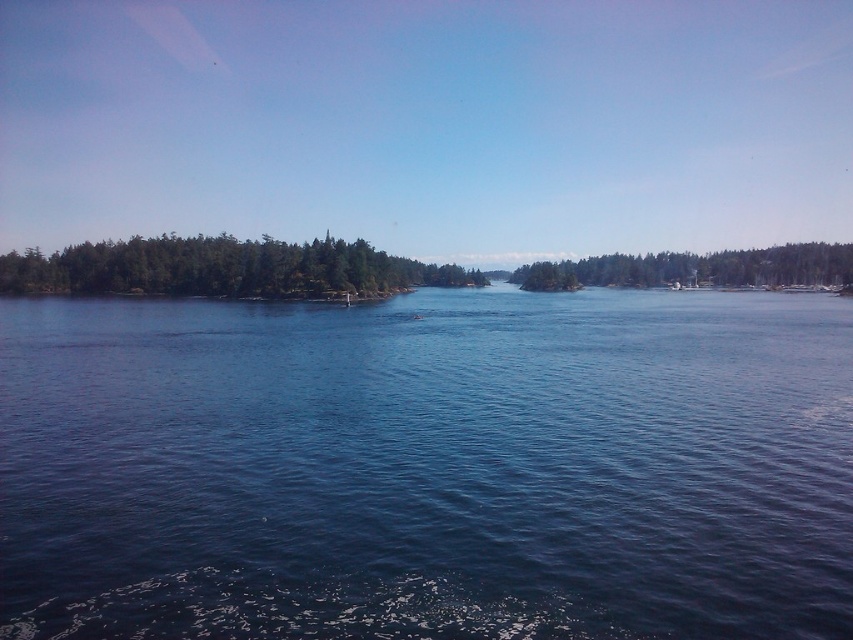
Does blue liquid water at center have a greater height compared to green matte trees at right?

Incorrect, blue liquid water at center's height is not larger of green matte trees at right's.

Based on the photo, who is more distant from viewer, (442, 618) or (787, 269)?

Point (787, 269)

Does point (260, 636) come behind point (830, 276)?

No, (260, 636) is closer to viewer.

Find the location of `blue liquid water at center`. blue liquid water at center is located at coordinates (427, 467).

Is point (711, 461) farther from viewer compared to point (190, 268)?

That is False.

Is point (836, 404) less distant than point (296, 291)?

Yes, it is.

Identify the location of blue liquid water at center. (427, 467).

Does point (233, 262) lie behind point (648, 278)?

No, (233, 262) is in front of (648, 278).

Measure the distance between green matte trees at left and camera.

The distance of green matte trees at left from camera is 112.42 meters.

Image resolution: width=853 pixels, height=640 pixels. What are the coordinates of `green matte trees at left` in the screenshot? It's located at (222, 268).

At what (x,y) coordinates should I click in order to perform the action: click on green matte trees at left. Please return your answer as a coordinate pair (x, y). Looking at the image, I should click on (222, 268).